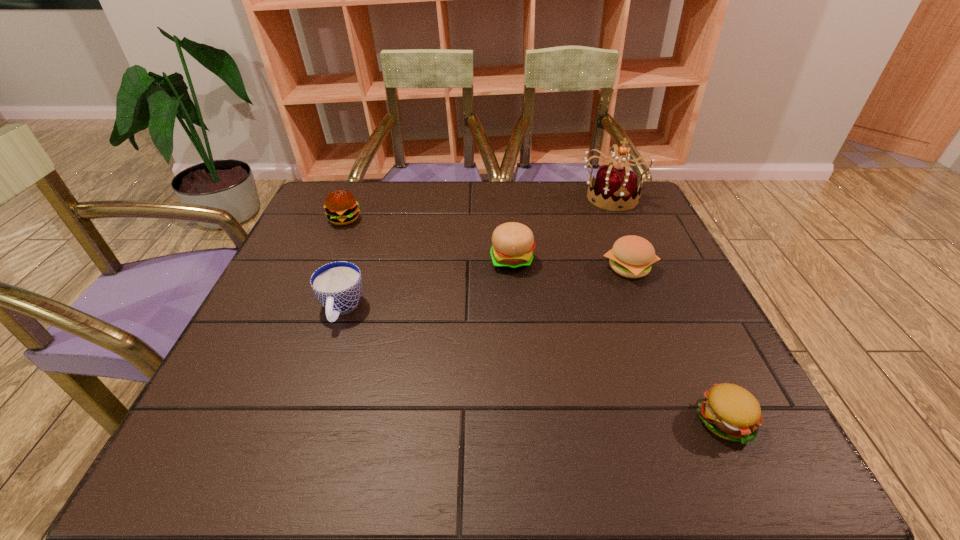
In the image, there is a desktop. Where is `vacant region at the far edge`? vacant region at the far edge is located at coordinates (397, 196).

This screenshot has height=540, width=960. What are the coordinates of `free location at the near edge of the desktop` in the screenshot? It's located at (607, 444).

This screenshot has width=960, height=540. Find the location of `free region at the left edge of the desktop`. free region at the left edge of the desktop is located at coordinates (289, 318).

This screenshot has width=960, height=540. I want to click on vacant point at the right edge, so pyautogui.click(x=664, y=319).

I want to click on free space at the near left corner of the desktop, so click(209, 437).

This screenshot has height=540, width=960. Identify the location of vacant space at the far right corner. (610, 214).

In the image, there is a desktop. At what (x,y) coordinates should I click in order to perform the action: click on free space at the near right corner. Please return your answer as a coordinate pair (x, y). This screenshot has height=540, width=960. Looking at the image, I should click on (726, 461).

Find the location of a particular element. The height and width of the screenshot is (540, 960). empty space that is in between the cup and the third hamburger from right to left is located at coordinates (426, 285).

Locate an element on the screen. This screenshot has height=540, width=960. vacant space that's between the cup and the tallest object is located at coordinates (476, 253).

Image resolution: width=960 pixels, height=540 pixels. I want to click on empty space that is in between the tallest object and the farthest hamburger, so click(478, 208).